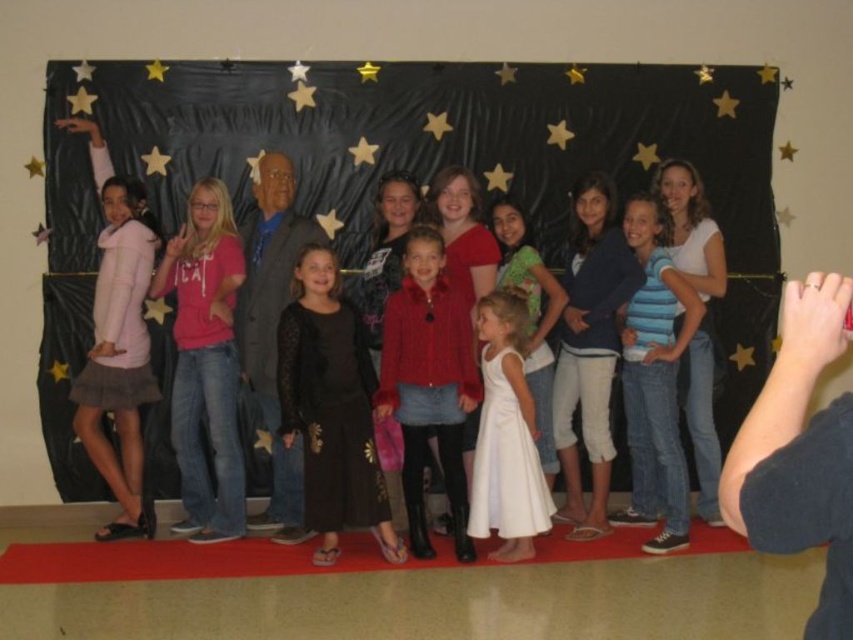
Question: Which point is farther to the camera?

Choices:
 (A) (178, 259)
 (B) (393, 292)
 (C) (648, 317)
 (D) (514, 429)

Answer: (A)

Question: Is matte red sweater at center positioned behind white satin dress at center?

Choices:
 (A) no
 (B) yes

Answer: (B)

Question: Which of these objects is positioned farthest from the white satin dress at center?

Choices:
 (A) matte red sweater at center
 (B) blue striped shirt at center
 (C) pink cotton shirt at center

Answer: (C)

Question: Is pink cotton shirt at center positioned at the back of matte red sweater at center?

Choices:
 (A) no
 (B) yes

Answer: (B)

Question: Can you confirm if matte red sweater at center is positioned below white satin dress at center?

Choices:
 (A) yes
 (B) no

Answer: (B)

Question: Among these points, which one is nearest to the camera?

Choices:
 (A) (425, 308)
 (B) (515, 493)
 (C) (231, 346)

Answer: (B)